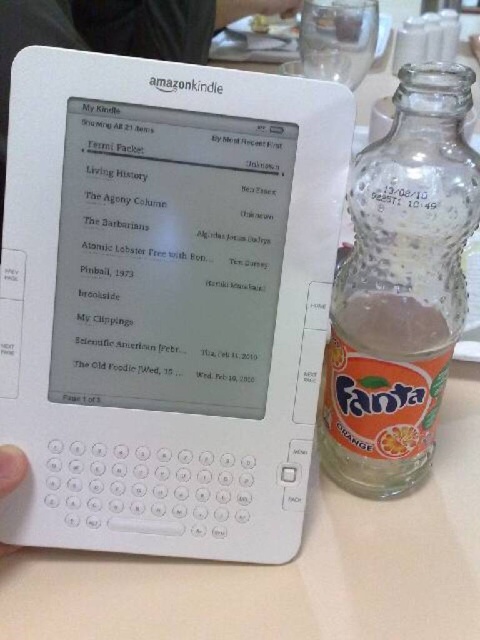
Question: Which point is closer to the camera taking this photo?

Choices:
 (A) (14, 474)
 (B) (190, 67)
 (C) (381, 250)

Answer: (B)

Question: Does white matte amazon kindle at center lie behind matte plastic fork at upper center?

Choices:
 (A) no
 (B) yes

Answer: (A)

Question: Does white plastic table at lower center appear over translucent glass bottle at right?

Choices:
 (A) yes
 (B) no

Answer: (B)

Question: Among these points, which one is nearest to the camera?

Choices:
 (A) (100, 211)
 (B) (338, 413)
 (C) (9, 465)
 (D) (287, 1)

Answer: (C)

Question: Does white matte amazon kindle at center come in front of orange carbonated drink at right?

Choices:
 (A) no
 (B) yes

Answer: (B)

Question: Among these points, which one is nearest to the camera?

Choices:
 (A) [x=389, y=506]
 (B) [x=277, y=230]
 (C) [x=478, y=172]

Answer: (C)